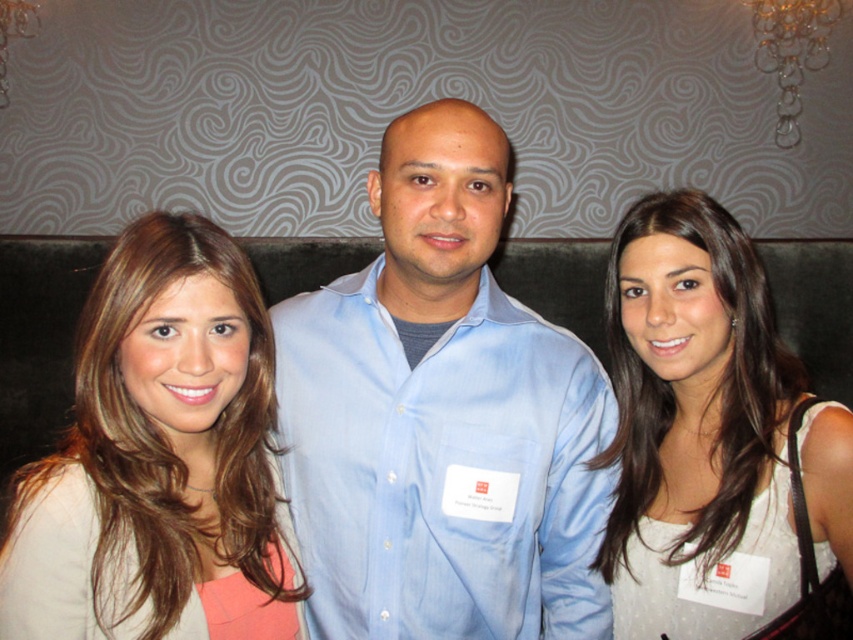
Between point (379, 384) and point (738, 544), which one is positioned in front?

Point (738, 544) is in front.

Can you confirm if light blue shirt at center is smaller than white satin dress at center?

Actually, light blue shirt at center might be larger than white satin dress at center.

Between point (439, 145) and point (639, 634), which one is positioned behind?

Point (639, 634)

You are a GUI agent. You are given a task and a screenshot of the screen. Output one action in this format:
    pyautogui.click(x=<x>, y=<y>)
    Task: Click on the light blue shirt at center
    Image resolution: width=853 pixels, height=640 pixels.
    Given the screenshot: What is the action you would take?
    pyautogui.click(x=440, y=419)

In the scene shown: Between blonde hair at center and white satin dress at center, which one appears on the left side from the viewer's perspective?

From the viewer's perspective, blonde hair at center appears more on the left side.

Can you confirm if blonde hair at center is positioned to the right of white satin dress at center?

In fact, blonde hair at center is to the left of white satin dress at center.

This screenshot has width=853, height=640. What do you see at coordinates (160, 460) in the screenshot?
I see `blonde hair at center` at bounding box center [160, 460].

This screenshot has width=853, height=640. I want to click on blonde hair at center, so click(x=160, y=460).

Is light blue shirt at center to the right of blonde hair at center from the viewer's perspective?

Yes, light blue shirt at center is to the right of blonde hair at center.

The height and width of the screenshot is (640, 853). What do you see at coordinates (440, 419) in the screenshot?
I see `light blue shirt at center` at bounding box center [440, 419].

Which is in front, point (358, 433) or point (216, 282)?

Point (216, 282) is in front.

Where is `light blue shirt at center`? This screenshot has width=853, height=640. light blue shirt at center is located at coordinates (440, 419).